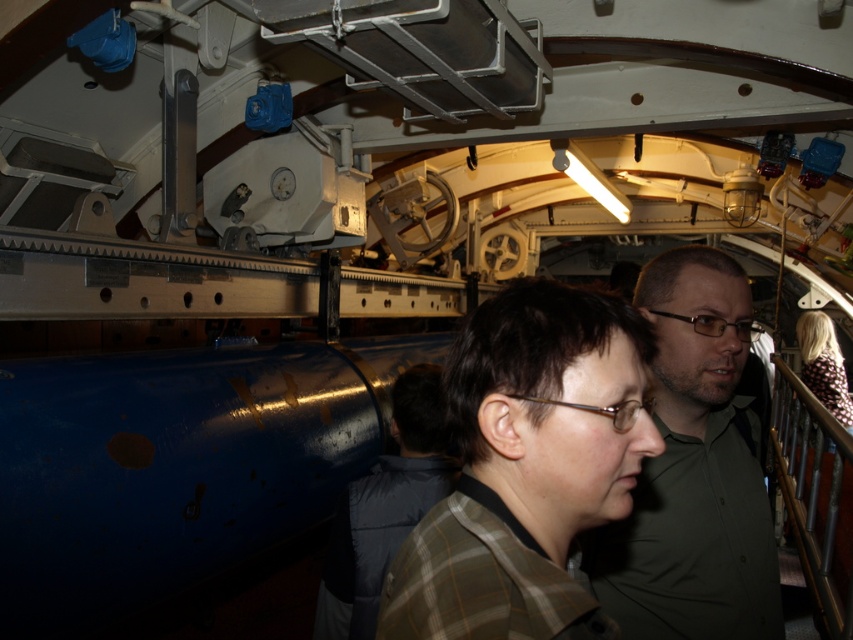
You are a maintenance technician in a submarine. You need to move from your current position near the green matte shirt at center to the control panel located near the floral print dress at center. Can you walk directly to it without any obstacles?

The distance between the green matte shirt at center and the floral print dress at center is 3.72 meters. Assuming there are no obstacles in between, you can walk directly to the control panel.

Based on the photo, you are navigating the submarine and need to locate the green matte shirt at center. What are the coordinates where you can find it?

The green matte shirt at center can be found at coordinates point (694,472).